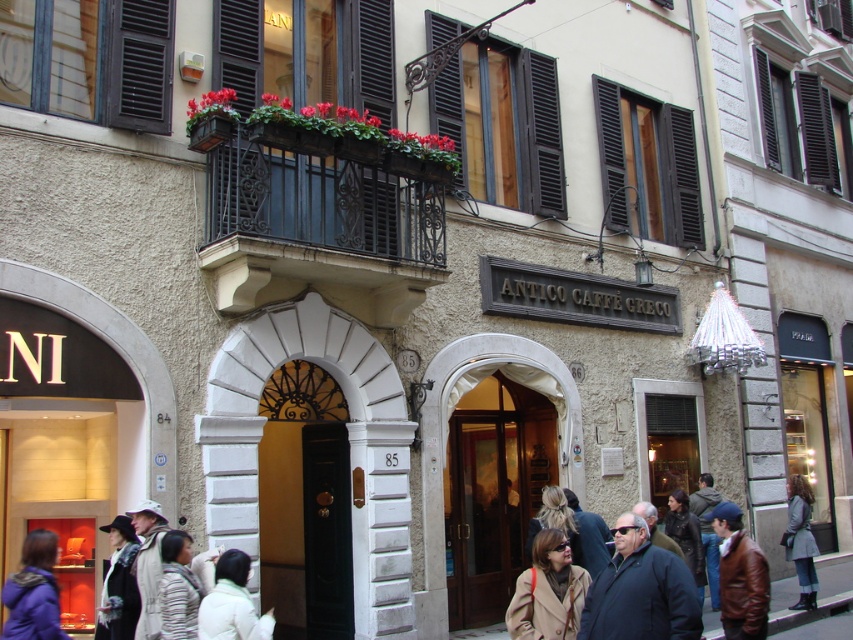
Does black polished wood door at center have a greater height compared to brown leather jacket at lower right?

Indeed, black polished wood door at center has a greater height compared to brown leather jacket at lower right.

Does black polished wood door at center appear on the left side of brown leather jacket at lower right?

Yes, black polished wood door at center is to the left of brown leather jacket at lower right.

Is point (321, 522) farther from camera compared to point (753, 554)?

That is True.

The width and height of the screenshot is (853, 640). I want to click on black polished wood door at center, so click(326, 531).

Which is below, dark wood shutters at upper center or white puffy coat at lower center?

white puffy coat at lower center is lower down.

At what (x,y) coordinates should I click in order to perform the action: click on dark wood shutters at upper center. Please return your answer as a coordinate pair (x, y). Image resolution: width=853 pixels, height=640 pixels. Looking at the image, I should click on (647, 166).

Image resolution: width=853 pixels, height=640 pixels. What do you see at coordinates (647, 166) in the screenshot?
I see `dark wood shutters at upper center` at bounding box center [647, 166].

At what (x,y) coordinates should I click in order to perform the action: click on dark wood shutters at upper center. Please return your answer as a coordinate pair (x, y). This screenshot has height=640, width=853. Looking at the image, I should click on (647, 166).

Is dark wood shutters at upper center above black polished wood door at center?

Yes.

Is point (675, 134) more distant than point (316, 573)?

Yes.

Who is more forward, (646,116) or (326,449)?

Positioned in front is point (326,449).

Identify the location of dark wood shutters at upper center. This screenshot has height=640, width=853. (647, 166).